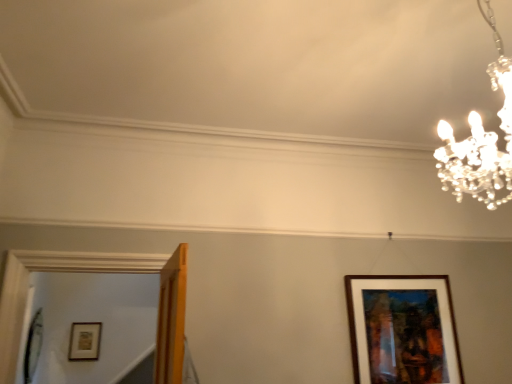
Question: From the image's perspective, is brown wooden picture frame at lower right, placed as the first picture frame when sorted from right to left, under wooden picture frame at lower left, the second picture frame from the front?

Choices:
 (A) no
 (B) yes

Answer: (A)

Question: Is brown wooden picture frame at lower right, the 2th picture frame in the back-to-front sequence, outside of wooden picture frame at lower left, placed as the 2th picture frame when sorted from top to bottom?

Choices:
 (A) no
 (B) yes

Answer: (B)

Question: Does brown wooden picture frame at lower right, positioned as the 2th picture frame in left-to-right order, turn towards wooden picture frame at lower left, arranged as the 1th picture frame when viewed from the back?

Choices:
 (A) yes
 (B) no

Answer: (B)

Question: From the image's perspective, is brown wooden picture frame at lower right, the 2th picture frame in the back-to-front sequence, on wooden picture frame at lower left, marked as the first picture frame in a bottom-to-top arrangement?

Choices:
 (A) no
 (B) yes

Answer: (B)

Question: Considering the relative sizes of brown wooden picture frame at lower right, which ranks as the second picture frame in bottom-to-top order, and wooden picture frame at lower left, marked as the first picture frame in a bottom-to-top arrangement, in the image provided, is brown wooden picture frame at lower right, which ranks as the second picture frame in bottom-to-top order, smaller than wooden picture frame at lower left, marked as the first picture frame in a bottom-to-top arrangement,?

Choices:
 (A) yes
 (B) no

Answer: (B)

Question: Looking at their shapes, would you say brown wooden picture frame at lower right, acting as the first picture frame starting from the top, is wider or thinner than wooden picture frame at lower left, the second picture frame positioned from the right?

Choices:
 (A) thin
 (B) wide

Answer: (B)

Question: Looking at the image, does brown wooden picture frame at lower right, the 2th picture frame in the back-to-front sequence, seem bigger or smaller compared to wooden picture frame at lower left, placed as the 2th picture frame when sorted from top to bottom?

Choices:
 (A) big
 (B) small

Answer: (A)

Question: Is brown wooden picture frame at lower right, acting as the first picture frame starting from the top, inside the boundaries of wooden picture frame at lower left, marked as the first picture frame in a bottom-to-top arrangement, or outside?

Choices:
 (A) inside
 (B) outside

Answer: (B)

Question: From a real-world perspective, is brown wooden picture frame at lower right, arranged as the 1th picture frame when viewed from the front, above or below wooden picture frame at lower left, arranged as the 1th picture frame when viewed from the back?

Choices:
 (A) below
 (B) above

Answer: (B)

Question: Is clear crystal chandelier at upper right taller or shorter than wooden picture frame at lower left, the second picture frame from the front?

Choices:
 (A) tall
 (B) short

Answer: (A)

Question: Would you say clear crystal chandelier at upper right is inside or outside wooden picture frame at lower left, the second picture frame from the front?

Choices:
 (A) outside
 (B) inside

Answer: (A)

Question: Considering the positions of clear crystal chandelier at upper right and wooden picture frame at lower left, the second picture frame positioned from the right, in the image, is clear crystal chandelier at upper right bigger or smaller than wooden picture frame at lower left, the second picture frame positioned from the right,?

Choices:
 (A) small
 (B) big

Answer: (B)

Question: Is point (451, 182) closer or farther from the camera than point (72, 342)?

Choices:
 (A) closer
 (B) farther

Answer: (A)

Question: From a real-world perspective, relative to brown wooden picture frame at lower right, the 2th picture frame in the back-to-front sequence, is clear crystal chandelier at upper right vertically above or below?

Choices:
 (A) above
 (B) below

Answer: (A)

Question: Considering the positions of point [505, 147] and point [414, 284], is point [505, 147] closer or farther from the camera than point [414, 284]?

Choices:
 (A) closer
 (B) farther

Answer: (A)